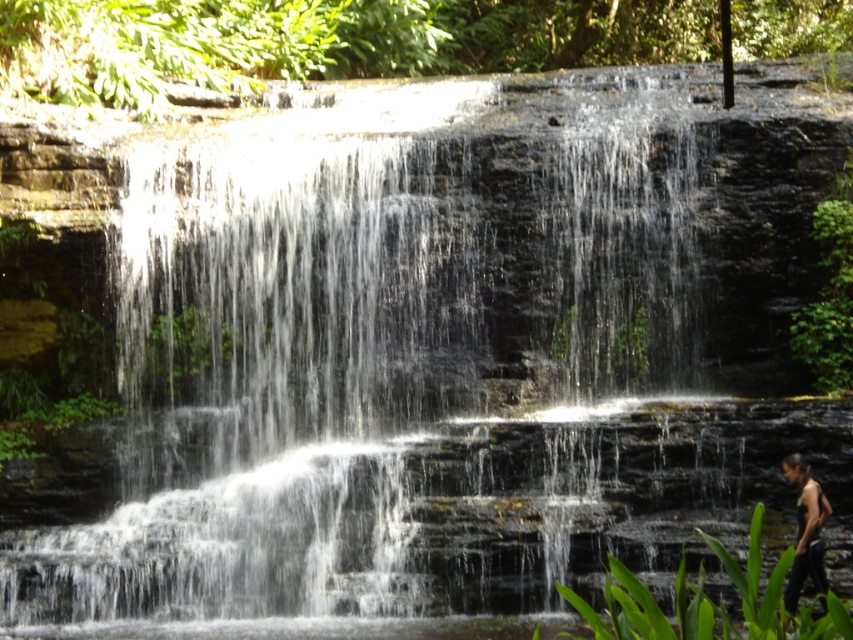
Between green leafy vegetation at upper center and black tank top at lower right, which one is positioned lower?

Positioned lower is black tank top at lower right.

Is point (306, 64) positioned behind point (798, 458)?

Yes, point (306, 64) is farther from viewer.

Where is `green leafy vegetation at upper center`? The width and height of the screenshot is (853, 640). green leafy vegetation at upper center is located at coordinates (x=323, y=42).

Does green leafy plant at lower right appear under black tank top at lower right?

Actually, green leafy plant at lower right is above black tank top at lower right.

Which of these two, green leafy plant at lower right or black tank top at lower right, stands shorter?

black tank top at lower right

Between point (769, 588) and point (805, 566), which one is positioned in front?

Point (769, 588) is in front.

Locate an element on the screen. The image size is (853, 640). green leafy plant at lower right is located at coordinates (711, 602).

Who is positioned more to the left, green leafy vegetation at upper center or green leafy plant at right?

From the viewer's perspective, green leafy vegetation at upper center appears more on the left side.

Where is `green leafy vegetation at upper center`? The height and width of the screenshot is (640, 853). green leafy vegetation at upper center is located at coordinates (323, 42).